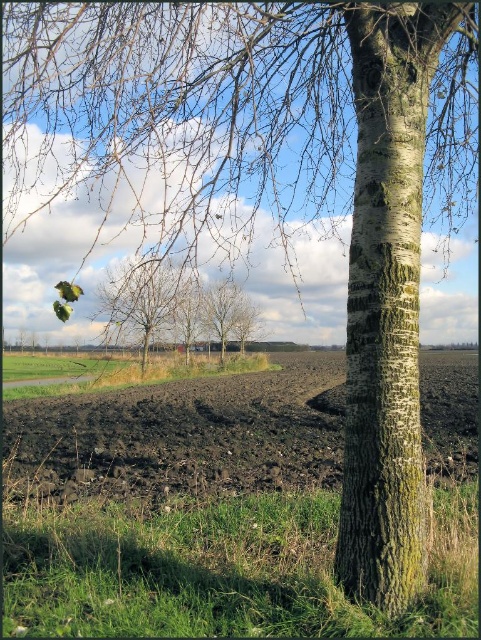
Question: Which point is closer to the camera?

Choices:
 (A) (168, 321)
 (B) (358, 20)

Answer: (B)

Question: Considering the relative positions of dark brown soil at lower left and smooth bark tree at center in the image provided, where is dark brown soil at lower left located with respect to smooth bark tree at center?

Choices:
 (A) above
 (B) below

Answer: (B)

Question: Which object is the farthest from the dark brown soil at lower left?

Choices:
 (A) bare branches at center
 (B) smooth bark tree at center
 (C) barky white tree trunk at right

Answer: (C)

Question: Does dark brown soil at lower left appear on the right side of bare branches at center?

Choices:
 (A) no
 (B) yes

Answer: (B)

Question: Which object is the farthest from the bare branches at center?

Choices:
 (A) dark brown soil at lower left
 (B) barky white tree trunk at right

Answer: (B)

Question: Considering the relative positions of barky white tree trunk at right and smooth bark tree at center in the image provided, where is barky white tree trunk at right located with respect to smooth bark tree at center?

Choices:
 (A) above
 (B) below

Answer: (B)